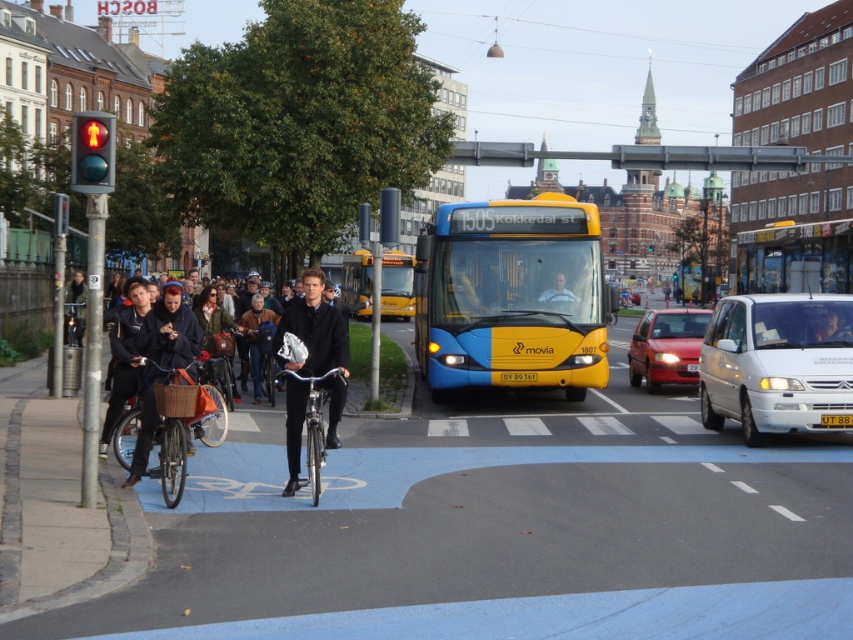
Does shiny red sedan at center have a greater width compared to brown leather jacket at center?

Yes, shiny red sedan at center is wider than brown leather jacket at center.

Can you confirm if shiny red sedan at center is positioned above brown leather jacket at center?

Correct, shiny red sedan at center is located above brown leather jacket at center.

Between point (639, 356) and point (253, 372), which one is positioned behind?

Positioned behind is point (639, 356).

Find the location of a particular element. Image resolution: width=853 pixels, height=640 pixels. shiny red sedan at center is located at coordinates (666, 348).

Who is positioned more to the left, blue/yellow plastic bus at center or brown leather jacket at center?

brown leather jacket at center

Is blue/yellow plastic bus at center taller than brown leather jacket at center?

Yes, blue/yellow plastic bus at center is taller than brown leather jacket at center.

This screenshot has width=853, height=640. In order to click on blue/yellow plastic bus at center in this screenshot , I will do `click(509, 298)`.

Which of these two, yellow and blue bus at center or yellow matte bus at center, stands taller?

Standing taller between the two is yellow matte bus at center.

Locate an element on the screen. The width and height of the screenshot is (853, 640). yellow and blue bus at center is located at coordinates (795, 259).